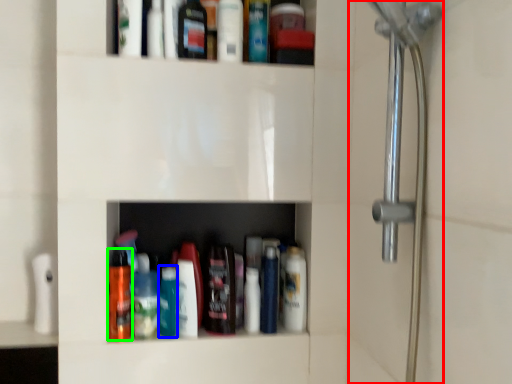
Question: Which is nearer to the shower door (highlighted by a red box)? bottle (highlighted by a blue box) or mouthwash (highlighted by a green box).

Choices:
 (A) bottle
 (B) mouthwash

Answer: (A)